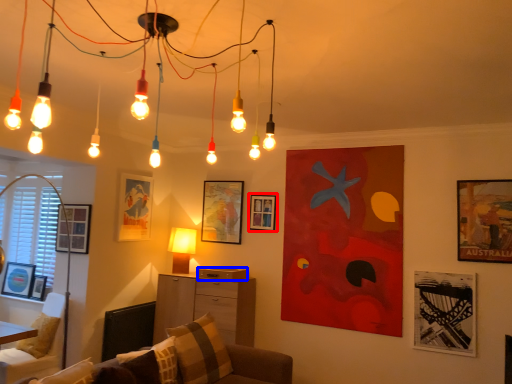
Question: Among these objects, which one is nearest to the camera, picture frame (highlighted by a red box) or drawer (highlighted by a blue box)?

Choices:
 (A) picture frame
 (B) drawer

Answer: (B)